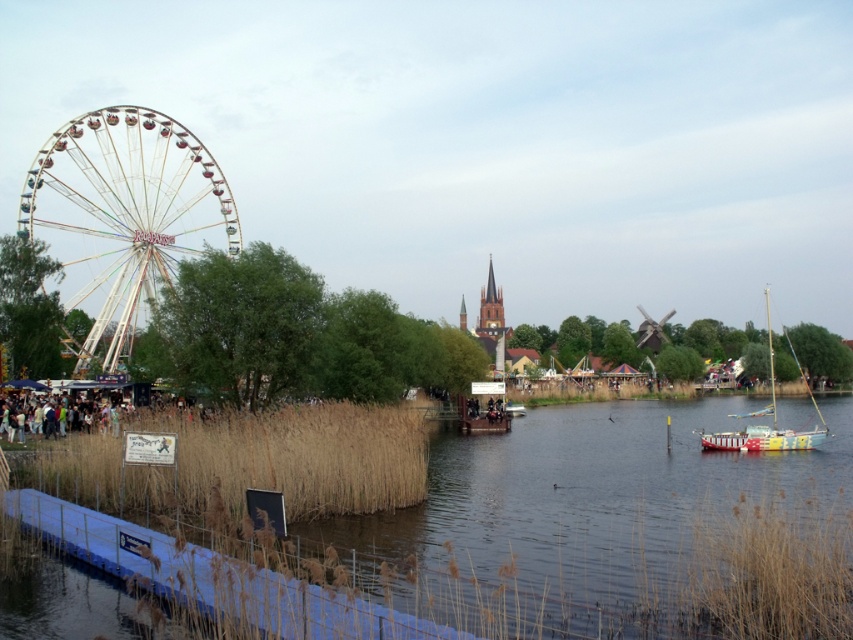
You are planning to take a photo of the multicolored metallic ferris wheel at left and the painted wood sailboat at right from a position where both are visible. Which object will appear smaller in the photo?

The multicolored metallic ferris wheel at left will appear smaller in the photo because it occupies less space than the painted wood sailboat at right according to the description.

You are a photographer trying to capture both the multicolored metallic ferris wheel at left and the painted wood sailboat at right in a single frame. Based on their widths, which object should you position closer to the center of your camera frame to ensure both fit properly?

The multicolored metallic ferris wheel at left is narrower than the painted wood sailboat at right, so positioning the sailboat closer to the center will help both fit in the frame since it requires more space.